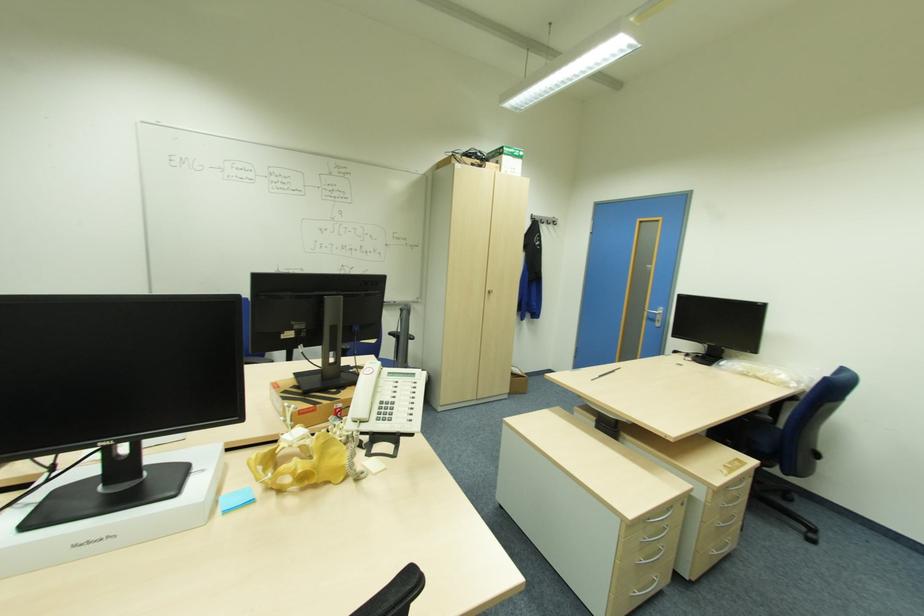
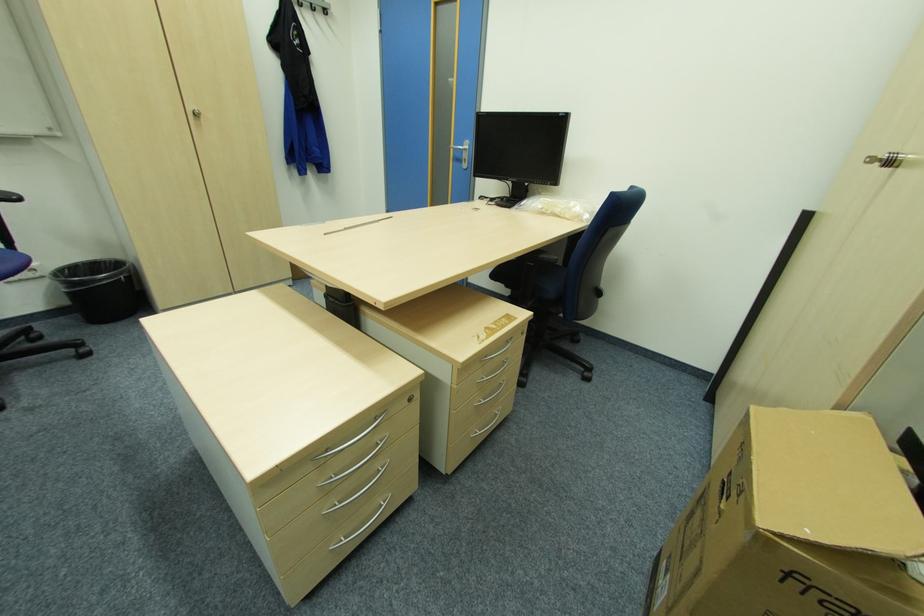
Where in the second image is the point corresponding to the point at 720,554 from the first image?

(482, 432)